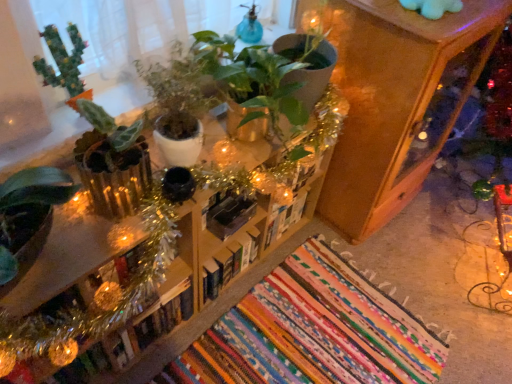
Locate an element on the screen. The width and height of the screenshot is (512, 384). wooden cabinet at upper right is located at coordinates (396, 98).

What do you see at coordinates (284, 217) in the screenshot? The width and height of the screenshot is (512, 384). I see `white matte book at center, acting as the 1th book starting from the right` at bounding box center [284, 217].

What do you see at coordinates (230, 215) in the screenshot?
I see `black matte bookshelf at center, the 3th book in the left-to-right sequence` at bounding box center [230, 215].

The width and height of the screenshot is (512, 384). Describe the element at coordinates (165, 316) in the screenshot. I see `hardcover book at center, the fourth book viewed from the right` at that location.

You are a GUI agent. You are given a task and a screenshot of the screen. Output one action in this format:
    pyautogui.click(x=<x>, y=<y>)
    Task: Click on the hardcover book at center, which is the third book in right-to-left order
    
    Given the screenshot: What is the action you would take?
    pyautogui.click(x=229, y=262)

How much space does green matte plant at center, which is the first houseplant in right-to-left order, occupy vertically?

The height of green matte plant at center, which is the first houseplant in right-to-left order, is 11.10 inches.

Identify the location of wooden cabinet at upper right. (396, 98).

Is hardcover book at center, the fourth book viewed from the right, further to camera compared to green matte plant at center, which ranks as the 2th houseplant in left-to-right order?

That is True.

In the image, is hardcover book at center, the fourth book viewed from the right, on the left side or the right side of green matte plant at center, which is the first houseplant in right-to-left order?

Based on their positions, hardcover book at center, the fourth book viewed from the right, is located to the left of green matte plant at center, which is the first houseplant in right-to-left order.

Is hardcover book at center, the first book in the left-to-right sequence, oriented towards green matte plant at center, which ranks as the 2th houseplant in left-to-right order?

No, hardcover book at center, the first book in the left-to-right sequence, is not oriented towards green matte plant at center, which ranks as the 2th houseplant in left-to-right order.

Is hardcover book at center, the fourth book viewed from the right, smaller than green matte plant at center, which is the first houseplant in right-to-left order?

Correct, hardcover book at center, the fourth book viewed from the right, occupies less space than green matte plant at center, which is the first houseplant in right-to-left order.

Is black matte bookshelf at center, the second book positioned from the right, looking in the opposite direction of green matte cactus at upper left, positioned as the second houseplant in right-to-left order?

No, black matte bookshelf at center, the second book positioned from the right, is not facing the opposite direction of green matte cactus at upper left, positioned as the second houseplant in right-to-left order.

Considering the relative sizes of black matte bookshelf at center, the second book positioned from the right, and green matte cactus at upper left, positioned as the second houseplant in right-to-left order, in the image provided, is black matte bookshelf at center, the second book positioned from the right, thinner than green matte cactus at upper left, positioned as the second houseplant in right-to-left order,?

No, black matte bookshelf at center, the second book positioned from the right, is not thinner than green matte cactus at upper left, positioned as the second houseplant in right-to-left order.

Is black matte bookshelf at center, the 3th book in the left-to-right sequence, bigger than green matte cactus at upper left, positioned as the second houseplant in right-to-left order?

No.

From a real-world perspective, is black matte bookshelf at center, the second book positioned from the right, above or below green matte cactus at upper left, positioned as the second houseplant in right-to-left order?

Clearly, from a real-world perspective, black matte bookshelf at center, the second book positioned from the right, is below green matte cactus at upper left, positioned as the second houseplant in right-to-left order.

How different are the orientations of hardcover book at center, which is the third book in right-to-left order, and green matte plant at center, which is the first houseplant in right-to-left order, in degrees?

The facing directions of hardcover book at center, which is the third book in right-to-left order, and green matte plant at center, which is the first houseplant in right-to-left order, are 2.75 degrees apart.

Would you say hardcover book at center, which is the third book in right-to-left order, is inside or outside green matte plant at center, which ranks as the 2th houseplant in left-to-right order?

hardcover book at center, which is the third book in right-to-left order, is spatially situated outside green matte plant at center, which ranks as the 2th houseplant in left-to-right order.

In the scene shown: Is hardcover book at center, arranged as the second book when viewed from the left, oriented away from green matte plant at center, which is the first houseplant in right-to-left order?

hardcover book at center, arranged as the second book when viewed from the left, does not have its back to green matte plant at center, which is the first houseplant in right-to-left order.

At what (x,y) coordinates should I click in order to perform the action: click on houseplant that is the 1st one when counting leftward from the hardcover book at center, which is the third book in right-to-left order. Please return your answer as a coordinate pair (x, y). The height and width of the screenshot is (384, 512). Looking at the image, I should click on (179, 104).

Which object is closer to the camera taking this photo, black matte bookshelf at center, the second book positioned from the right, or hardcover book at center, arranged as the second book when viewed from the left?

black matte bookshelf at center, the second book positioned from the right, is closer to the camera.

You are a GUI agent. You are given a task and a screenshot of the screen. Output one action in this format:
    pyautogui.click(x=<x>, y=<y>)
    Task: Click on the 1st book directly beneath the black matte bookshelf at center, the second book positioned from the right (from a real-world perspective)
    
    Given the screenshot: What is the action you would take?
    click(229, 262)

Could you tell me if black matte bookshelf at center, the 3th book in the left-to-right sequence, is turned towards hardcover book at center, arranged as the second book when viewed from the left?

No, black matte bookshelf at center, the 3th book in the left-to-right sequence, is not facing towards hardcover book at center, arranged as the second book when viewed from the left.

Is point (228, 204) farther from camera compared to point (214, 293)?

No, it is in front of (214, 293).

From a real-world perspective, which object stands above the other?

From a 3D spatial view, green matte cactus at upper left, which is the first houseplant from left to right, is above.

Can you confirm if green matte cactus at upper left, which is the first houseplant from left to right, is smaller than hardcover book at center, which is the third book in right-to-left order?

Yes, green matte cactus at upper left, which is the first houseplant from left to right, is smaller than hardcover book at center, which is the third book in right-to-left order.

Considering the relative sizes of green matte cactus at upper left, which is the first houseplant from left to right, and hardcover book at center, which is the third book in right-to-left order, in the image provided, is green matte cactus at upper left, which is the first houseplant from left to right, thinner than hardcover book at center, which is the third book in right-to-left order,?

Indeed, green matte cactus at upper left, which is the first houseplant from left to right, has a lesser width compared to hardcover book at center, which is the third book in right-to-left order.

From a real-world perspective, is hardcover book at center, the first book in the left-to-right sequence, on hardcover book at center, arranged as the second book when viewed from the left?

No, from a real-world perspective, hardcover book at center, the first book in the left-to-right sequence, is not over hardcover book at center, arranged as the second book when viewed from the left

Which is in front, hardcover book at center, the fourth book viewed from the right, or hardcover book at center, which is the third book in right-to-left order?

hardcover book at center, the fourth book viewed from the right, is more forward.

Considering the points (237, 271) and (288, 226), which point is behind, point (237, 271) or point (288, 226)?

Point (288, 226)

Which book is the 2nd one when counting from the right side of the hardcover book at center, arranged as the second book when viewed from the left? Please provide its 2D coordinates.

[(284, 217)]

Relative to white matte book at center, acting as the 1th book starting from the right, is hardcover book at center, which is the third book in right-to-left order, in front or behind?

hardcover book at center, which is the third book in right-to-left order, is positioned closer to the viewer than white matte book at center, acting as the 1th book starting from the right.

Image resolution: width=512 pixels, height=384 pixels. I want to click on book that is the 4th object located below the green matte plant at center, which is the first houseplant in right-to-left order (from the image's perspective), so click(x=165, y=316).

Identify the location of the 1st book positioned below the green matte cactus at upper left, which is the first houseplant from left to right (from a real-world perspective). This screenshot has height=384, width=512. (230, 215).

Considering their positions, is black matte bookshelf at center, the second book positioned from the right, positioned further to hardcover book at center, arranged as the second book when viewed from the left, than green matte cactus at upper left, which is the first houseplant from left to right?

Based on the image, green matte cactus at upper left, which is the first houseplant from left to right, appears to be further to hardcover book at center, arranged as the second book when viewed from the left.

Which object lies nearer to the anchor point wooden bookshelf at center, hardcover book at center, the fourth book viewed from the right, or green matte plant at center, which ranks as the 2th houseplant in left-to-right order?

green matte plant at center, which ranks as the 2th houseplant in left-to-right order, is closer to wooden bookshelf at center.

In the scene shown: Based on their spatial positions, is wooden bookshelf at center or black matte bookshelf at center, the 3th book in the left-to-right sequence, further from green matte plant at center, which ranks as the 2th houseplant in left-to-right order?

black matte bookshelf at center, the 3th book in the left-to-right sequence.

From the image, which object appears to be farther from green matte plant at center, which is the first houseplant in right-to-left order, hardcover book at center, the first book in the left-to-right sequence, or black matte bookshelf at center, the 3th book in the left-to-right sequence?

hardcover book at center, the first book in the left-to-right sequence, is positioned further to the anchor green matte plant at center, which is the first houseplant in right-to-left order.

Which object lies nearer to the anchor point white matte book at center, which is the fourth book in left-to-right order, green matte cactus at upper left, positioned as the second houseplant in right-to-left order, or wooden bookshelf at center?

wooden bookshelf at center is positioned closer to the anchor white matte book at center, which is the fourth book in left-to-right order.

Looking at the image, which one is located closer to black matte bookshelf at center, the 3th book in the left-to-right sequence, green matte plant at center, which ranks as the 2th houseplant in left-to-right order, or white matte book at center, acting as the 1th book starting from the right?

white matte book at center, acting as the 1th book starting from the right, is closer to black matte bookshelf at center, the 3th book in the left-to-right sequence.

Estimate the real-world distances between objects in this image. Which object is further from hardcover book at center, arranged as the second book when viewed from the left, hardcover book at center, the first book in the left-to-right sequence, or black matte bookshelf at center, the 3th book in the left-to-right sequence?

hardcover book at center, the first book in the left-to-right sequence.

From the image, which object appears to be nearer to black matte bookshelf at center, the 3th book in the left-to-right sequence, hardcover book at center, the fourth book viewed from the right, or white matte book at center, acting as the 1th book starting from the right?

Among the two, white matte book at center, acting as the 1th book starting from the right, is located nearer to black matte bookshelf at center, the 3th book in the left-to-right sequence.

The width and height of the screenshot is (512, 384). What are the coordinates of `houseplant between green matte cactus at upper left, positioned as the second houseplant in right-to-left order, and hardcover book at center, the fourth book viewed from the right, vertically` in the screenshot? It's located at (179, 104).

Where is `houseplant between hardcover book at center, the fourth book viewed from the right, and wooden cabinet at upper right, in the horizontal direction`? houseplant between hardcover book at center, the fourth book viewed from the right, and wooden cabinet at upper right, in the horizontal direction is located at coordinates (179, 104).

Locate an element on the screen. The image size is (512, 384). houseplant between green matte plant at center, which ranks as the 2th houseplant in left-to-right order, and black matte bookshelf at center, the second book positioned from the right, along the z-axis is located at coordinates (62, 60).

Where is `furniture that lies between green matte plant at center, which is the first houseplant in right-to-left order, and hardcover book at center, the first book in the left-to-right sequence, from top to bottom`? This screenshot has width=512, height=384. furniture that lies between green matte plant at center, which is the first houseplant in right-to-left order, and hardcover book at center, the first book in the left-to-right sequence, from top to bottom is located at coordinates (87, 309).